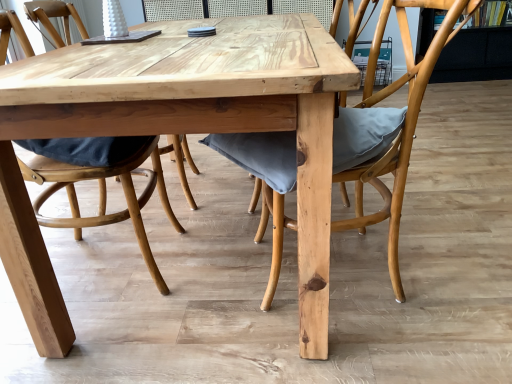
Question: From the image's perspective, is matte wood chair at center, acting as the second chair starting from the right, located above matte gray cushion at center, which is the first chair in right-to-left order?

Choices:
 (A) no
 (B) yes

Answer: (A)

Question: Considering the relative sizes of matte wood chair at center, which is counted as the first chair, starting from the left, and matte gray cushion at center, the second chair viewed from the left, in the image provided, is matte wood chair at center, which is counted as the first chair, starting from the left, bigger than matte gray cushion at center, the second chair viewed from the left,?

Choices:
 (A) no
 (B) yes

Answer: (A)

Question: Is matte wood chair at center, which is counted as the first chair, starting from the left, positioned before matte gray cushion at center, the second chair viewed from the left?

Choices:
 (A) yes
 (B) no

Answer: (B)

Question: Does matte wood chair at center, acting as the second chair starting from the right, have a smaller size compared to matte gray cushion at center, which is the first chair in right-to-left order?

Choices:
 (A) no
 (B) yes

Answer: (B)

Question: Does matte wood chair at center, acting as the second chair starting from the right, appear on the left side of matte gray cushion at center, which is the first chair in right-to-left order?

Choices:
 (A) yes
 (B) no

Answer: (A)

Question: Does point (312, 38) appear closer or farther from the camera than point (140, 230)?

Choices:
 (A) closer
 (B) farther

Answer: (A)

Question: Looking at the image, does natural wood table at center seem bigger or smaller compared to matte wood chair at center, which is counted as the first chair, starting from the left?

Choices:
 (A) small
 (B) big

Answer: (B)

Question: From a real-world perspective, is natural wood table at center positioned above or below matte wood chair at center, acting as the second chair starting from the right?

Choices:
 (A) below
 (B) above

Answer: (A)

Question: Relative to matte wood chair at center, which is counted as the first chair, starting from the left, is natural wood table at center in front or behind?

Choices:
 (A) front
 (B) behind

Answer: (A)

Question: Looking at their shapes, would you say natural wood table at center is wider or thinner than matte gray cushion at center, the second chair viewed from the left?

Choices:
 (A) wide
 (B) thin

Answer: (A)

Question: Is point (72, 132) positioned closer to the camera than point (449, 1)?

Choices:
 (A) closer
 (B) farther

Answer: (A)

Question: In the image, is natural wood table at center positioned in front of or behind matte gray cushion at center, the second chair viewed from the left?

Choices:
 (A) behind
 (B) front

Answer: (B)

Question: In terms of size, does natural wood table at center appear bigger or smaller than matte gray cushion at center, which is the first chair in right-to-left order?

Choices:
 (A) big
 (B) small

Answer: (A)

Question: In the image, is matte gray cushion at center, the second chair viewed from the left, positioned in front of or behind natural wood table at center?

Choices:
 (A) front
 (B) behind

Answer: (B)

Question: Is point (399, 140) positioned closer to the camera than point (61, 130)?

Choices:
 (A) closer
 (B) farther

Answer: (B)